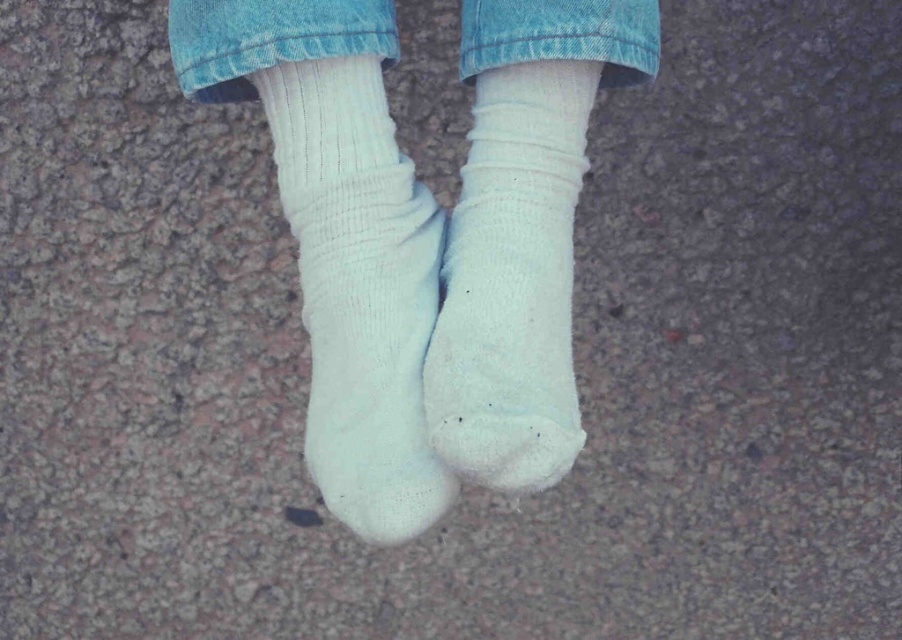
Question: Among these points, which one is farthest from the camera?

Choices:
 (A) (573, 65)
 (B) (436, 333)
 (C) (375, 388)

Answer: (A)

Question: Is white ribbed sock at center bigger than white knitted sock at center?

Choices:
 (A) yes
 (B) no

Answer: (A)

Question: Considering the real-world distances, which object is farthest from the white knitted sock at center?

Choices:
 (A) white ribbed sock at center
 (B) white ribbed socks at center
 (C) denim at center

Answer: (C)

Question: Estimate the real-world distances between objects in this image. Which object is closer to the white ribbed socks at center?

Choices:
 (A) white knitted sock at center
 (B) denim at center

Answer: (A)

Question: Is white ribbed socks at center to the left of white knitted sock at center from the viewer's perspective?

Choices:
 (A) yes
 (B) no

Answer: (A)

Question: Does white ribbed sock at center appear over denim at center?

Choices:
 (A) no
 (B) yes

Answer: (A)